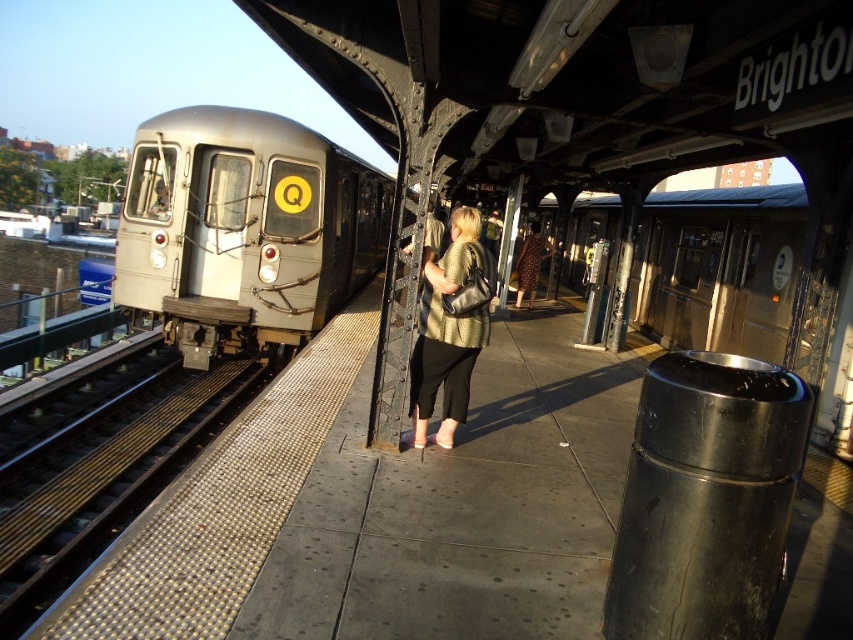
Can you confirm if metallic gold blouse at center is positioned below brown dotted dress at center?

Indeed, metallic gold blouse at center is positioned under brown dotted dress at center.

Is point (430, 403) more distant than point (527, 276)?

No, (430, 403) is closer to viewer.

Is point (467, 368) positioned before point (524, 244)?

Yes, it is.

Where is `metallic gold blouse at center`? This screenshot has width=853, height=640. metallic gold blouse at center is located at coordinates (450, 328).

Image resolution: width=853 pixels, height=640 pixels. I want to click on silver metallic train at left, so click(245, 230).

Describe the element at coordinates (245, 230) in the screenshot. The image size is (853, 640). I see `silver metallic train at left` at that location.

At what (x,y) coordinates should I click in order to perform the action: click on silver metallic train at left. Please return your answer as a coordinate pair (x, y). This screenshot has height=640, width=853. Looking at the image, I should click on (245, 230).

Can you confirm if metal/textured train track at left is thinner than metallic gold blouse at center?

No, metal/textured train track at left is not thinner than metallic gold blouse at center.

Who is positioned more to the right, metal/textured train track at left or metallic gold blouse at center?

Positioned to the right is metallic gold blouse at center.

Measure the distance between point (39,595) and camera.

Point (39,595) is 4.04 meters from camera.

Locate an element on the screen. Image resolution: width=853 pixels, height=640 pixels. metal/textured train track at left is located at coordinates click(103, 484).